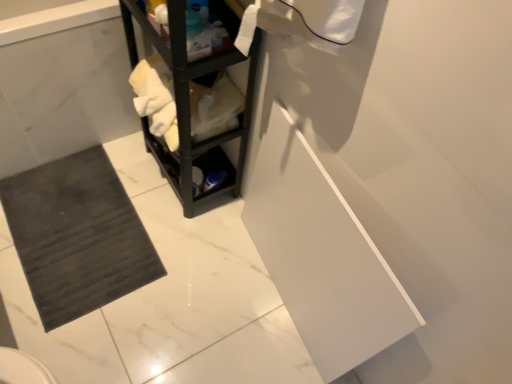
Question: Considering the positions of dark gray rubber bath mat at lower left and dark gray rubber bath mat at lower left in the image, is dark gray rubber bath mat at lower left taller or shorter than dark gray rubber bath mat at lower left?

Choices:
 (A) tall
 (B) short

Answer: (B)

Question: Is point (33, 288) closer or farther from the camera than point (23, 82)?

Choices:
 (A) farther
 (B) closer

Answer: (A)

Question: Which object is positioned closest to the black matte shelf at center?

Choices:
 (A) dark gray rubber bath mat at lower left
 (B) dark gray rubber bath mat at lower left

Answer: (B)

Question: Based on their relative distances, which object is nearer to the dark gray rubber bath mat at lower left?

Choices:
 (A) black matte shelf at center
 (B) dark gray rubber bath mat at lower left

Answer: (B)